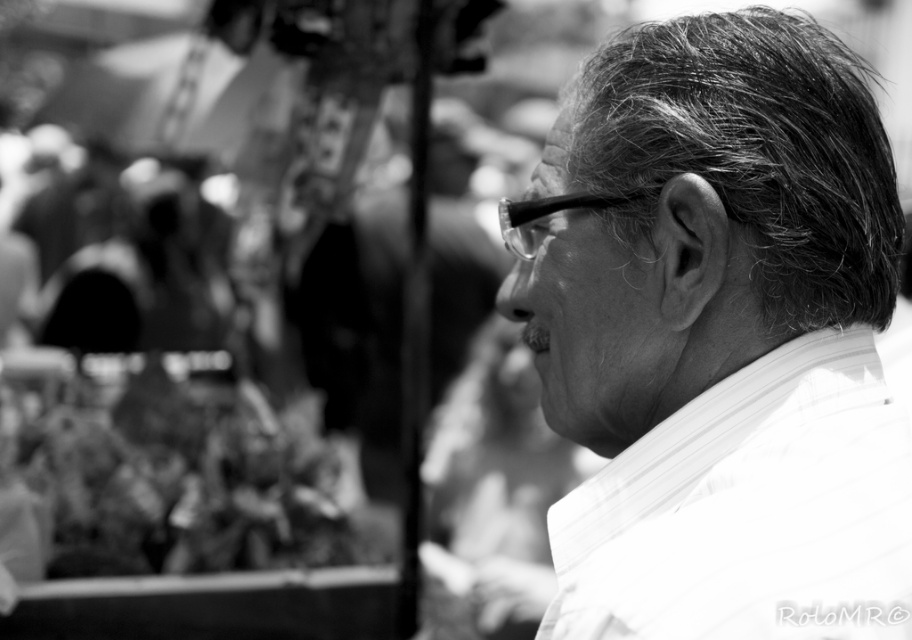
You are a photographer analyzing this image. You notice the white textured shirt at right and the gray textured hair at upper right. Based on their positions, which object is closer to the right edge of the image?

The gray textured hair at upper right is closer to the right edge of the image because the white textured shirt at right is positioned to its left.

Based on the scene description, where exactly is the white striped dress shirt at right located in the image?

The white striped dress shirt at right is located at point coordinates of 0.800 on the x axis and 0.822 on the y axis.